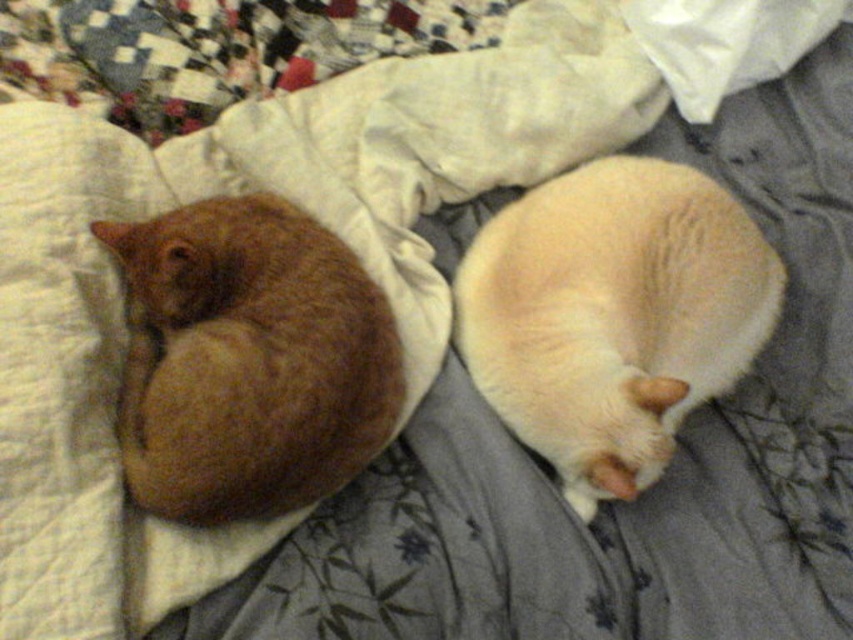
Looking at this image, who is higher up, soft cream fur cat at right or orange fur cat at left?

Positioned higher is soft cream fur cat at right.

Is soft cream fur cat at right to the right of orange fur cat at left from the viewer's perspective?

Yes, soft cream fur cat at right is to the right of orange fur cat at left.

What do you see at coordinates (613, 316) in the screenshot?
I see `soft cream fur cat at right` at bounding box center [613, 316].

Locate an element on the screen. soft cream fur cat at right is located at coordinates (613, 316).